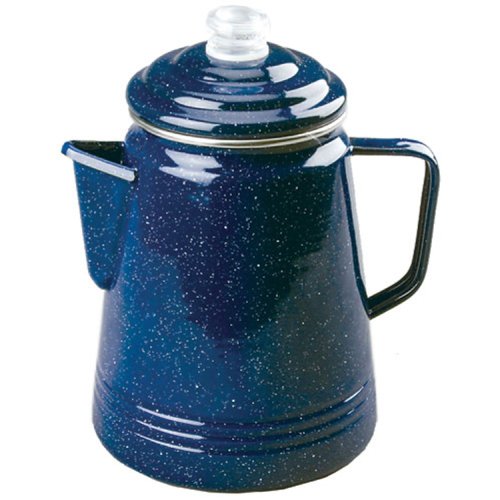
At what (x,y) coordinates should I click in order to perform the action: click on blue emalliert dish. Please return your answer as a coordinate pair (x, y). The width and height of the screenshot is (500, 500). Looking at the image, I should click on (225, 285).